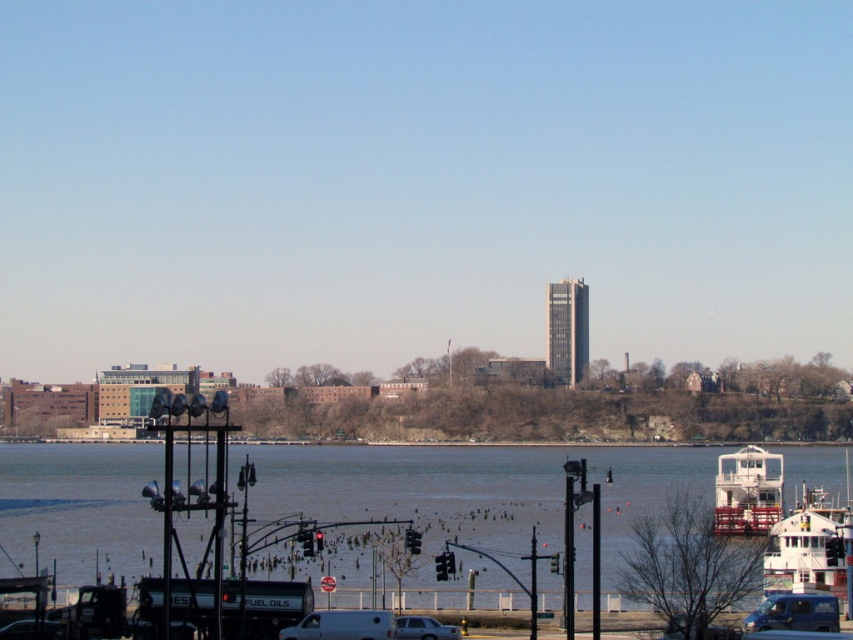
Question: Can you confirm if white glossy boat at lower right is bigger than white matte van at center?

Choices:
 (A) no
 (B) yes

Answer: (B)

Question: Which point appears closest to the camera in this image?

Choices:
 (A) (445, 634)
 (B) (834, 614)
 (C) (30, 564)
 (D) (364, 618)

Answer: (D)

Question: Is white matte boat at lower right closer to camera compared to white glossy boat at lower right?

Choices:
 (A) no
 (B) yes

Answer: (B)

Question: Is blue metallic van at lower right closer to the viewer compared to silver metallic car at lower center?

Choices:
 (A) no
 (B) yes

Answer: (A)

Question: Considering the real-world distances, which object is closest to the silver metallic car at lower center?

Choices:
 (A) white matte boat at lower right
 (B) white matte van at center

Answer: (B)

Question: Considering the real-world distances, which object is farthest from the silver metallic car at lower center?

Choices:
 (A) white matte van at center
 (B) white matte boat at lower right

Answer: (B)